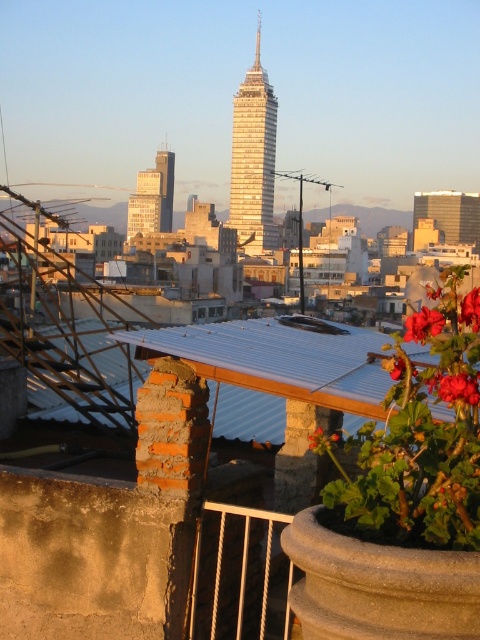
Is matte glass building at center further to the viewer compared to vivid red petals at center right?

Yes, matte glass building at center is further from the viewer.

Does matte glass building at center have a greater width compared to vivid red petals at center right?

Indeed, matte glass building at center has a greater width compared to vivid red petals at center right.

Find the location of `matte glass building at center`. matte glass building at center is located at coordinates (153, 196).

Is matte glass building at center thinner than red matte flower at upper right?

In fact, matte glass building at center might be wider than red matte flower at upper right.

Is matte glass building at center to the left of red matte flower at upper right from the viewer's perspective?

Indeed, matte glass building at center is positioned on the left side of red matte flower at upper right.

Is point (169, 205) closer to camera compared to point (430, 326)?

No.

Find the location of a particular element. matte glass building at center is located at coordinates (153, 196).

The height and width of the screenshot is (640, 480). What are the coordinates of `matte glass skyscraper at center` in the screenshot? It's located at (450, 214).

Locate an element on the screen. The image size is (480, 640). matte glass skyscraper at center is located at coordinates (450, 214).